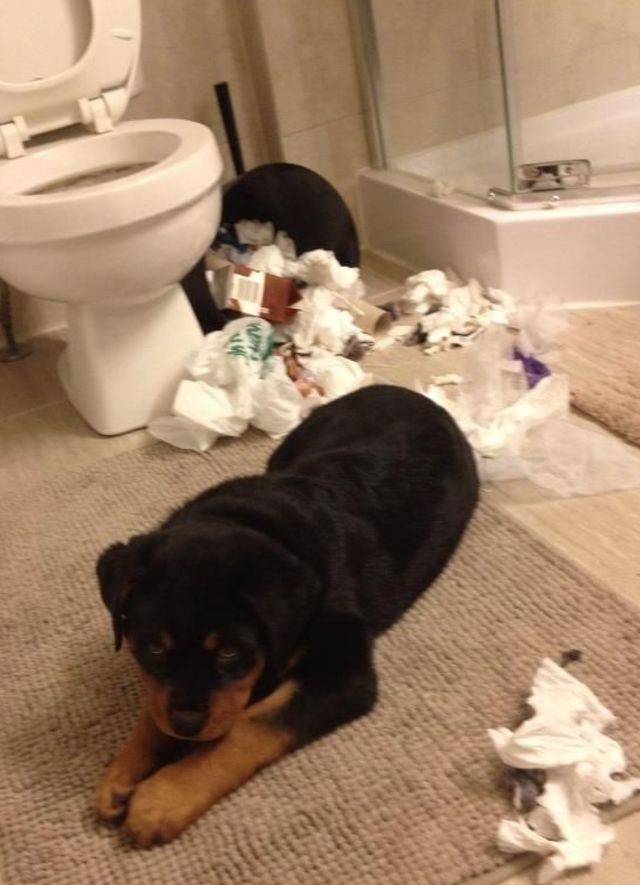
Locate an element on the screen. upturned toilet seat is located at coordinates (109, 49).